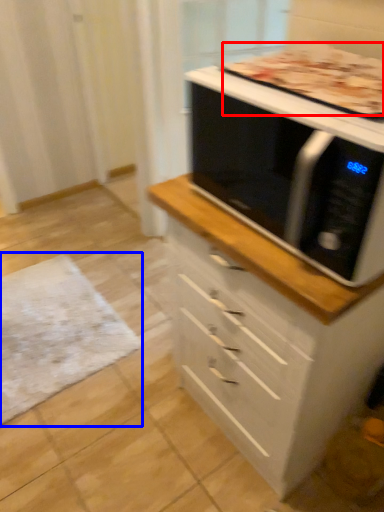
Question: Which object is closer to the camera taking this photo, pizza (highlighted by a red box) or mat (highlighted by a blue box)?

Choices:
 (A) pizza
 (B) mat

Answer: (A)